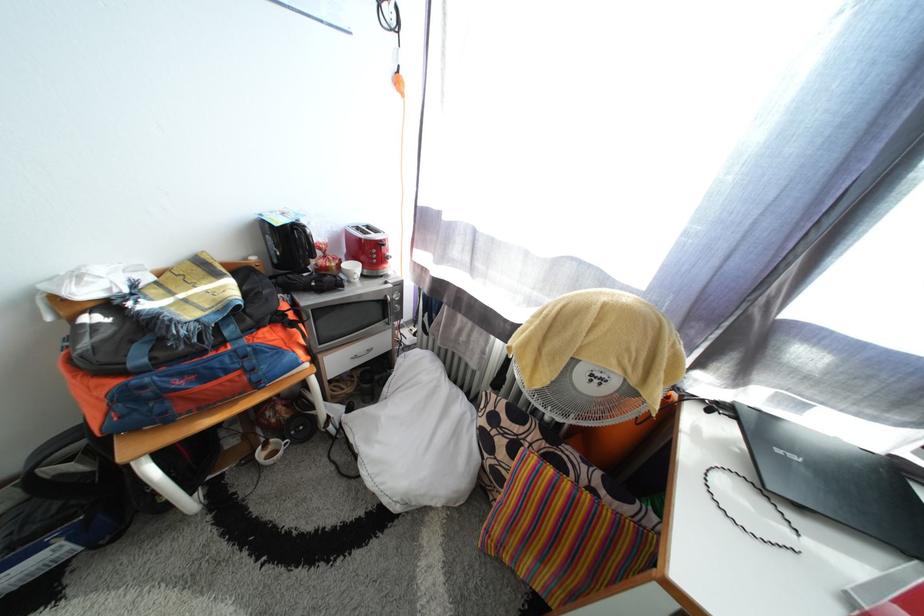
Where would you push the red toaster lever? Please return your answer as a coordinate pair (x, y).

(382, 241)